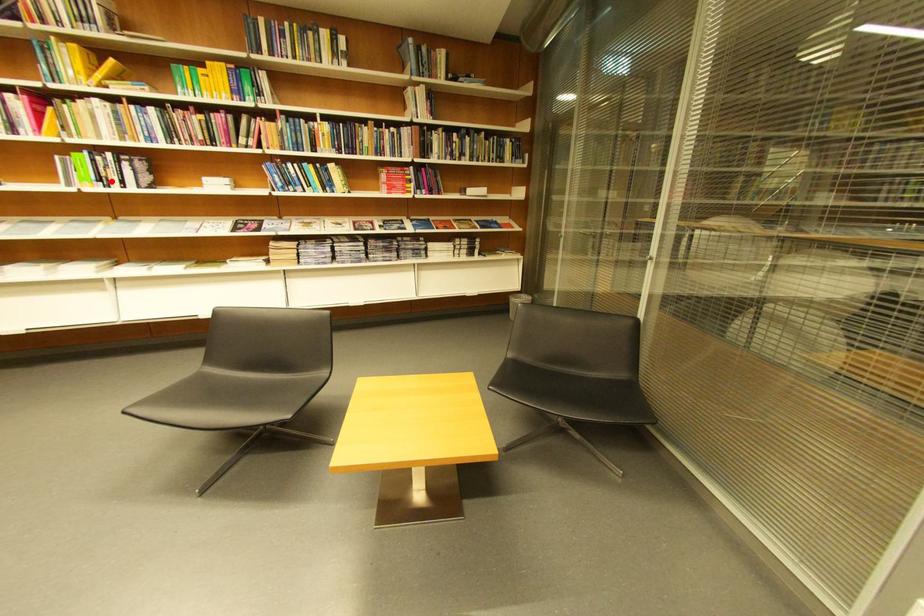
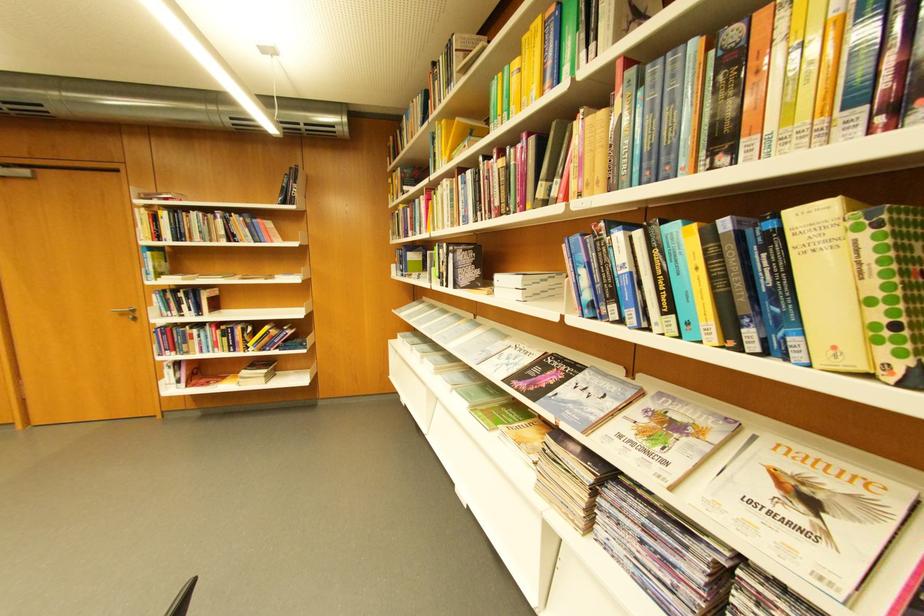
Find the pixel in the second image that matches the highlighted location in the first image.

(451, 278)